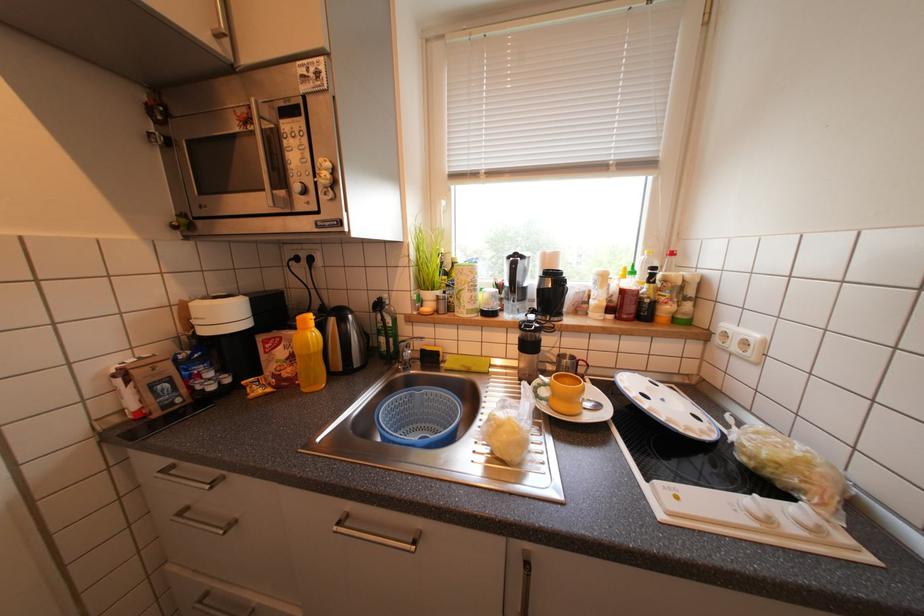
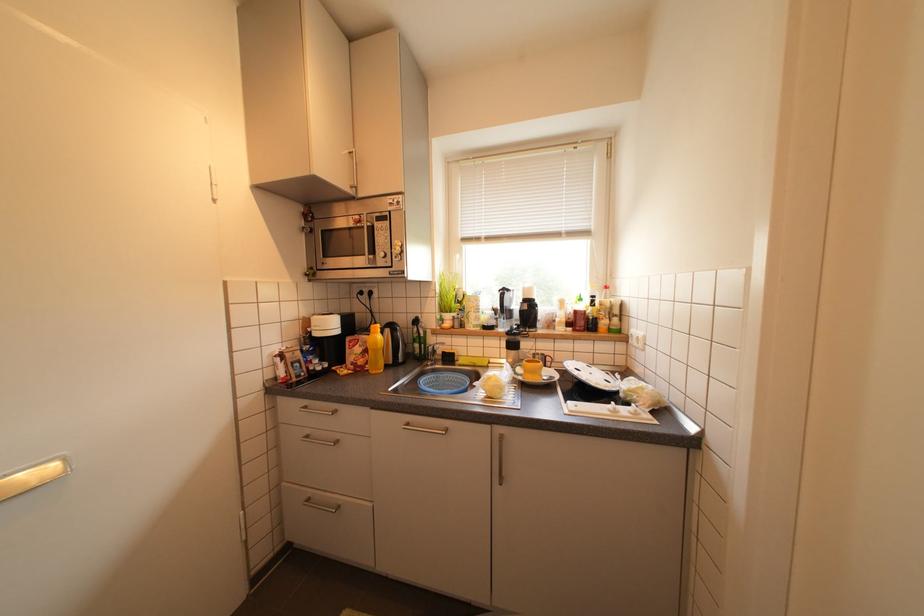
Question: The first image is from the beginning of the video and the second image is from the end. How did the camera likely rotate when shooting the video?

Choices:
 (A) Left
 (B) Right
 (C) Up
 (D) Down

Answer: (C)